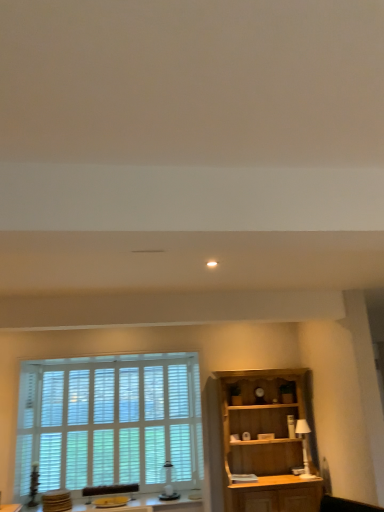
This screenshot has width=384, height=512. Find the location of `wooden cabinet at lower right`. wooden cabinet at lower right is located at coordinates (265, 443).

This screenshot has height=512, width=384. Describe the element at coordinates (265, 443) in the screenshot. I see `wooden cabinet at lower right` at that location.

This screenshot has height=512, width=384. In order to click on white wood blinds at left in this screenshot , I will do `click(109, 422)`.

Describe the element at coordinates (109, 422) in the screenshot. The width and height of the screenshot is (384, 512). I see `white wood blinds at left` at that location.

Measure the distance between point (115, 507) and camera.

Point (115, 507) is 4.40 meters from camera.

You are a GUI agent. You are given a task and a screenshot of the screen. Output one action in this format:
    pyautogui.click(x=<x>, y=<y>)
    Task: Click on the wooden swivel chair at lower left
    Image resolution: width=384 pixels, height=512 pixels.
    Given the screenshot: What is the action you would take?
    pyautogui.click(x=110, y=489)

Find the location of a particular element. The height and width of the screenshot is (512, 384). wooden cabinet at lower right is located at coordinates (265, 443).

From the image's perspective, which is above, wooden table at lower center or white wood blinds at left?

From the image's view, white wood blinds at left is above.

Can you confirm if wooden table at lower center is bigger than white wood blinds at left?

Actually, wooden table at lower center might be smaller than white wood blinds at left.

The width and height of the screenshot is (384, 512). In order to click on window that is above the wooden table at lower center (from the image's perspective) in this screenshot , I will do `click(109, 422)`.

Considering the sizes of objects wooden table at lower center and white wood blinds at left in the image provided, who is taller, wooden table at lower center or white wood blinds at left?

Standing taller between the two is white wood blinds at left.

Which of these two, wooden cabinet at lower right or white glossy lamp at right, is thinner?

With smaller width is white glossy lamp at right.

Is wooden cabinet at lower right situated inside white glossy lamp at right or outside?

wooden cabinet at lower right cannot be found inside white glossy lamp at right.

Looking at the image, does wooden cabinet at lower right seem bigger or smaller compared to white glossy lamp at right?

In the image, wooden cabinet at lower right appears to be larger than white glossy lamp at right.

From a real-world perspective, between wooden cabinet at lower right and white glossy lamp at right, who is vertically lower?

From a 3D spatial view, white glossy lamp at right is below.

The image size is (384, 512). Identify the location of table on the right of wooden swivel chair at lower left. (149, 504).

Between wooden swivel chair at lower left and wooden table at lower center, which one has larger size?

Bigger between the two is wooden table at lower center.

Is wooden table at lower center completely or partially inside wooden swivel chair at lower left?

Definitely not — wooden table at lower center is not inside wooden swivel chair at lower left.

Based on the photo, from a real-world perspective, is white wood blinds at left over wooden swivel chair at lower left?

Correct, in the physical world, white wood blinds at left is higher than wooden swivel chair at lower left.

Does white wood blinds at left appear on the left side of wooden swivel chair at lower left?

In fact, white wood blinds at left is to the right of wooden swivel chair at lower left.

From the image's perspective, which is below, white wood blinds at left or wooden swivel chair at lower left?

wooden swivel chair at lower left is shown below in the image.

Looking at this image, can you tell me how much white wood blinds at left and wooden swivel chair at lower left differ in facing direction?

white wood blinds at left and wooden swivel chair at lower left are facing 0.878 degrees away from each other.

Is white wood blinds at left facing away from wooden table at lower center?

Correct, white wood blinds at left is looking away from wooden table at lower center.

The width and height of the screenshot is (384, 512). I want to click on window that appears above the wooden table at lower center (from a real-world perspective), so click(109, 422).

Is white wood blinds at left wider or thinner than wooden table at lower center?

Considering their sizes, white wood blinds at left looks slimmer than wooden table at lower center.

Is white wood blinds at left beside wooden table at lower center?

No, white wood blinds at left is not beside wooden table at lower center.

Considering the positions of objects white glossy lamp at right and white wood blinds at left in the image provided, who is more to the left, white glossy lamp at right or white wood blinds at left?

From the viewer's perspective, white wood blinds at left appears more on the left side.

Does white glossy lamp at right have a lesser height compared to white wood blinds at left?

Correct, white glossy lamp at right is not as tall as white wood blinds at left.

Locate an element on the screen. The width and height of the screenshot is (384, 512). window that is on the left side of white glossy lamp at right is located at coordinates 109,422.

Looking at this image, between white glossy lamp at right and white wood blinds at left, which one is positioned in front?

white wood blinds at left is closer to the camera.

From a real-world perspective, which is physically below, white glossy lamp at right or wooden table at lower center?

wooden table at lower center.

Who is shorter, white glossy lamp at right or wooden table at lower center?

With less height is wooden table at lower center.

Are white glossy lamp at right and wooden table at lower center making contact?

white glossy lamp at right and wooden table at lower center are clearly separated.

From the picture: Does white glossy lamp at right have a greater width compared to wooden table at lower center?

No.

Find the location of `table located behind the white wood blinds at left`. table located behind the white wood blinds at left is located at coordinates (149, 504).

Image resolution: width=384 pixels, height=512 pixels. I want to click on lamp that appears on the right of wooden cabinet at lower right, so click(x=304, y=445).

From the image, which object appears to be nearer to white glossy lamp at right, wooden swivel chair at lower left or wooden cabinet at lower right?

Among the two, wooden cabinet at lower right is located nearer to white glossy lamp at right.

Which object lies further to the anchor point wooden cabinet at lower right, wooden swivel chair at lower left or wooden table at lower center?

The object further to wooden cabinet at lower right is wooden swivel chair at lower left.

When comparing their distances from wooden table at lower center, does white glossy lamp at right or white wood blinds at left seem closer?

The object closer to wooden table at lower center is white wood blinds at left.

Considering their positions, is wooden cabinet at lower right positioned closer to white glossy lamp at right than wooden table at lower center?

wooden cabinet at lower right.

Based on their spatial positions, is wooden cabinet at lower right or wooden table at lower center closer to wooden swivel chair at lower left?

Among the two, wooden table at lower center is located nearer to wooden swivel chair at lower left.

Based on their spatial positions, is white glossy lamp at right or wooden swivel chair at lower left closer to wooden table at lower center?

The object closer to wooden table at lower center is wooden swivel chair at lower left.

From the image, which object appears to be farther from wooden table at lower center, wooden cabinet at lower right or wooden swivel chair at lower left?

wooden cabinet at lower right lies further to wooden table at lower center than the other object.

Considering their positions, is white wood blinds at left positioned further to wooden cabinet at lower right than wooden swivel chair at lower left?

wooden swivel chair at lower left.

I want to click on table located between wooden swivel chair at lower left and white glossy lamp at right in the left-right direction, so click(x=149, y=504).

Find the location of a particular element. The width and height of the screenshot is (384, 512). cupboard between wooden table at lower center and white glossy lamp at right in the horizontal direction is located at coordinates (265, 443).

The image size is (384, 512). What are the coordinates of `cupboard situated between white wood blinds at left and white glossy lamp at right from left to right` in the screenshot? It's located at (265, 443).

The image size is (384, 512). What are the coordinates of `window located between wooden table at lower center and wooden cabinet at lower right in the left-right direction` in the screenshot? It's located at (109, 422).